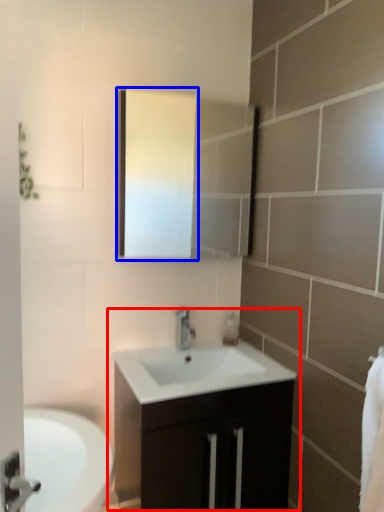
Question: Which object is closer to the camera taking this photo, bathroom cabinet (highlighted by a red box) or medicine cabinet (highlighted by a blue box)?

Choices:
 (A) bathroom cabinet
 (B) medicine cabinet

Answer: (A)